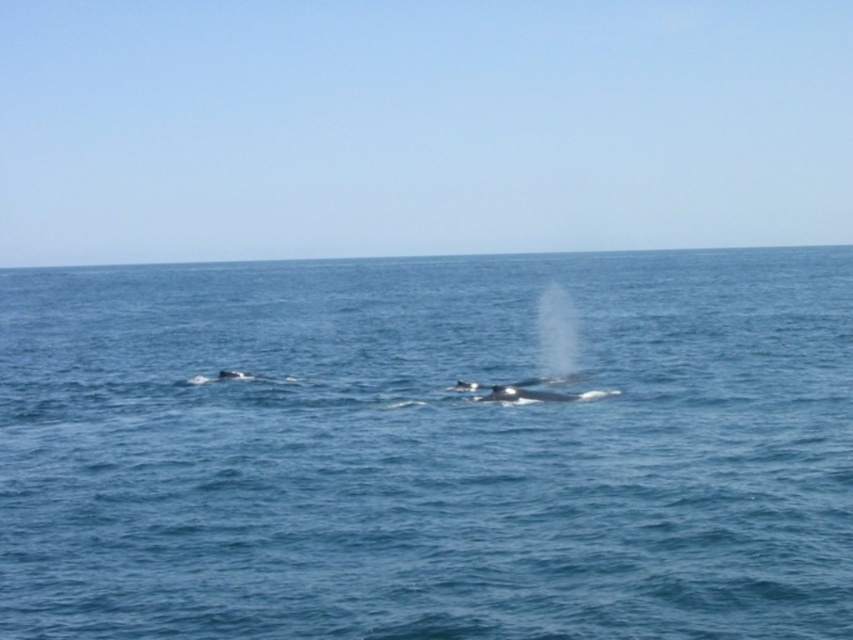
In order to click on blue water at center in this screenshot , I will do click(x=427, y=449).

Does blue water at center have a greater height compared to gray matte whale at left?

Yes.

Where is `blue water at center`? This screenshot has height=640, width=853. blue water at center is located at coordinates (427, 449).

Is gray smooth whale at center thinner than gray matte whale at left?

No, gray smooth whale at center is not thinner than gray matte whale at left.

Is point (515, 384) behind point (238, 372)?

No, (515, 384) is in front of (238, 372).

What are the coordinates of `gray smooth whale at center` in the screenshot? It's located at (524, 394).

Who is shorter, blue water at center or gray smooth whale at center?

Standing shorter between the two is gray smooth whale at center.

Can you confirm if blue water at center is taller than gray smooth whale at center?

Correct, blue water at center is much taller as gray smooth whale at center.

Does point (247, 484) come closer to viewer compared to point (543, 390)?

Yes, it is in front of point (543, 390).

At what (x,y) coordinates should I click in order to perform the action: click on blue water at center. Please return your answer as a coordinate pair (x, y). The height and width of the screenshot is (640, 853). Looking at the image, I should click on (427, 449).